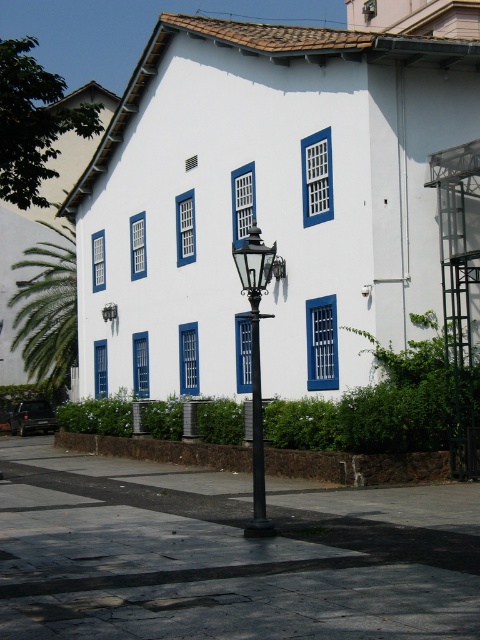
Does point (260, 387) come closer to viewer compared to point (256, 531)?

No.

Identify the location of black metal/texture lamp post at center. (255, 362).

Find the location of `black metal/texture lamp post at center`. black metal/texture lamp post at center is located at coordinates pyautogui.click(x=255, y=362).

Who is more distant from viewer, (x=72, y=317) or (x=260, y=372)?

The point (x=72, y=317) is behind.

Between point (22, 314) and point (251, 525), which one is positioned behind?

The point (22, 314) is more distant.

Locate an element on the screen. green leafy palm tree at left is located at coordinates (48, 310).

Can you confirm if green leafy palm tree at left is positioned above black metal/texture lamp post at center?

Yes.

Is point (27, 374) positioned in front of point (254, 429)?

No, it is behind (254, 429).

Locate an element on the screen. This screenshot has width=480, height=640. green leafy palm tree at left is located at coordinates (48, 310).